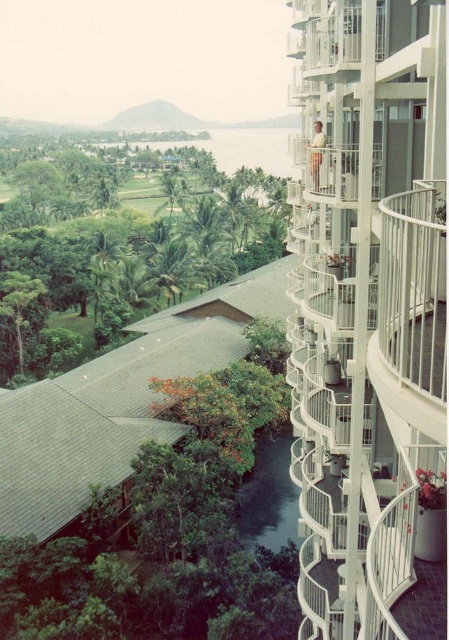
Question: Is white metal balcony at upper right to the left of white metal balcony at upper center from the viewer's perspective?

Choices:
 (A) no
 (B) yes

Answer: (A)

Question: Can you confirm if green leafy tree at center is wider than white metal balcony at upper center?

Choices:
 (A) no
 (B) yes

Answer: (B)

Question: Based on their relative distances, which object is farther from the green leafy tree at center?

Choices:
 (A) white metal balcony at upper center
 (B) white metal balcony at upper right

Answer: (A)

Question: Is white metal balcony at upper right below green leafy tree at center?

Choices:
 (A) yes
 (B) no

Answer: (A)

Question: Estimate the real-world distances between objects in this image. Which object is farther from the green leafy tree at center?

Choices:
 (A) white metal balcony at upper right
 (B) white metal balcony at upper center

Answer: (B)

Question: Which point appears farthest from the camera in this image?

Choices:
 (A) (74, 294)
 (B) (435, 156)
 (C) (348, 161)

Answer: (A)